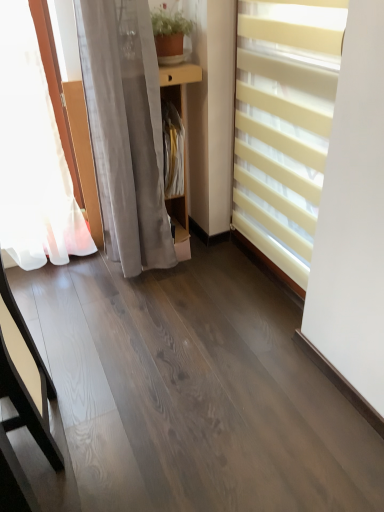
Image resolution: width=384 pixels, height=512 pixels. In order to click on sheer white curtain at left in this screenshot , I will do `click(125, 131)`.

I want to click on sheer white curtain at left, so 125,131.

In the scene shown: From a real-world perspective, does sheer white curtain at left sit lower than wooden shelf at center?

No, from a real-world perspective, sheer white curtain at left is not under wooden shelf at center.

Which object is thinner, sheer white curtain at left or wooden shelf at center?

wooden shelf at center.

Is wooden shelf at center at the back of sheer white curtain at left?

No.

Based on the photo, which is correct: sheer white curtain at left is inside wooden shelf at center, or outside of it?

sheer white curtain at left is not enclosed by wooden shelf at center.

From the picture: From the image's perspective, which one is positioned higher, matte yellow blinds at right or wooden shelf at center?

wooden shelf at center is shown above in the image.

Is matte yellow blinds at right spatially inside wooden shelf at center, or outside of it?

matte yellow blinds at right is outside wooden shelf at center.

Is point (297, 105) farther from camera compared to point (178, 106)?

That is False.

You are a GUI agent. You are given a task and a screenshot of the screen. Output one action in this format:
    pyautogui.click(x=<x>, y=<y>)
    Task: Click on the shelf on the left of matte yellow blinds at right
    The height and width of the screenshot is (512, 384).
    Given the screenshot: What is the action you would take?
    181,197

Can matte yellow blinds at right be found inside sheer white curtain at left?

No.

Considering the positions of points (122, 261) and (251, 100), is point (122, 261) closer to camera compared to point (251, 100)?

No, it is not.

From the image's perspective, is sheer white curtain at left on top of matte yellow blinds at right?

Yes, from the image's perspective, sheer white curtain at left is over matte yellow blinds at right.

How different are the orientations of sheer white curtain at left and matte yellow blinds at right in degrees?

sheer white curtain at left and matte yellow blinds at right are facing 88.3 degrees away from each other.

From a real-world perspective, is light brown wood table at left positioned over sheer white curtain at left based on gravity?

No, from a real-world perspective, light brown wood table at left is not over sheer white curtain at left

Identify the location of curtain to the right of light brown wood table at left. This screenshot has width=384, height=512. (125, 131).

Which object is positioned more to the left, light brown wood table at left or sheer white curtain at left?

light brown wood table at left.

Between point (35, 435) and point (129, 103), which one is positioned behind?

The point (129, 103) is more distant.

Can you confirm if wooden shelf at center is smaller than light brown wood table at left?

Indeed, wooden shelf at center has a smaller size compared to light brown wood table at left.

Is wooden shelf at center turned away from light brown wood table at left?

wooden shelf at center is not turned away from light brown wood table at left.

Does wooden shelf at center lie behind light brown wood table at left?

Yes, the depth of wooden shelf at center is greater than that of light brown wood table at left.

Is there a large distance between wooden shelf at center and light brown wood table at left?

Yes, wooden shelf at center and light brown wood table at left are quite far apart.

Does point (148, 181) lie in front of point (0, 358)?

No, it is not.

Considering the positions of objects sheer white curtain at left and light brown wood table at left in the image provided, who is more to the right, sheer white curtain at left or light brown wood table at left?

sheer white curtain at left is more to the right.

Consider the image. In terms of height, does sheer white curtain at left look taller or shorter compared to light brown wood table at left?

In the image, sheer white curtain at left appears to be taller than light brown wood table at left.

Which object is more forward, sheer white curtain at left or light brown wood table at left?

light brown wood table at left is closer to the camera.

Looking at this image, relative to matte yellow blinds at right, is wooden shelf at center in front or behind?

In the image, wooden shelf at center appears behind matte yellow blinds at right.

Considering the positions of objects wooden shelf at center and matte yellow blinds at right in the image provided, who is more to the left, wooden shelf at center or matte yellow blinds at right?

Positioned to the left is wooden shelf at center.

Where is `shelf above the matte yellow blinds at right (from the image's perspective)`? This screenshot has width=384, height=512. shelf above the matte yellow blinds at right (from the image's perspective) is located at coordinates (181, 197).

Consider the image. Is wooden shelf at center oriented towards matte yellow blinds at right?

No.

In the image, there is a sheer white curtain at left. Where is `shelf above it (from the image's perspective)`? Image resolution: width=384 pixels, height=512 pixels. shelf above it (from the image's perspective) is located at coordinates (181, 197).

Find the location of `window blind located below the wooden shelf at center (from the image's perspective)`. window blind located below the wooden shelf at center (from the image's perspective) is located at coordinates (284, 124).

Based on their spatial positions, is light brown wood table at left or wooden shelf at center closer to sheer white curtain at left?

wooden shelf at center is closer to sheer white curtain at left.

When comparing their distances from wooden shelf at center, does sheer white curtain at left or light brown wood table at left seem further?

light brown wood table at left is further to wooden shelf at center.

From the image, which object appears to be nearer to light brown wood table at left, matte yellow blinds at right or wooden shelf at center?

The object closer to light brown wood table at left is matte yellow blinds at right.

Based on their spatial positions, is wooden shelf at center or light brown wood table at left further from matte yellow blinds at right?

Based on the image, light brown wood table at left appears to be further to matte yellow blinds at right.

When comparing their distances from light brown wood table at left, does sheer white curtain at left or matte yellow blinds at right seem further?

matte yellow blinds at right lies further to light brown wood table at left than the other object.

From the image, which object appears to be farther from light brown wood table at left, wooden shelf at center or sheer white curtain at left?

wooden shelf at center is positioned further to the anchor light brown wood table at left.

From the image, which object appears to be farther from sheer white curtain at left, matte yellow blinds at right or light brown wood table at left?

Among the two, light brown wood table at left is located further to sheer white curtain at left.

From the image, which object appears to be nearer to wooden shelf at center, matte yellow blinds at right or sheer white curtain at left?

sheer white curtain at left is positioned closer to the anchor wooden shelf at center.

This screenshot has width=384, height=512. In order to click on curtain between matte yellow blinds at right and wooden shelf at center from front to back in this screenshot , I will do `click(125, 131)`.

Where is `curtain located between light brown wood table at left and matte yellow blinds at right in the left-right direction`? This screenshot has height=512, width=384. curtain located between light brown wood table at left and matte yellow blinds at right in the left-right direction is located at coordinates (125, 131).

Identify the location of window blind between light brown wood table at left and wooden shelf at center along the z-axis. (284, 124).

Locate an element on the screen. curtain between light brown wood table at left and wooden shelf at center from front to back is located at coordinates (125, 131).